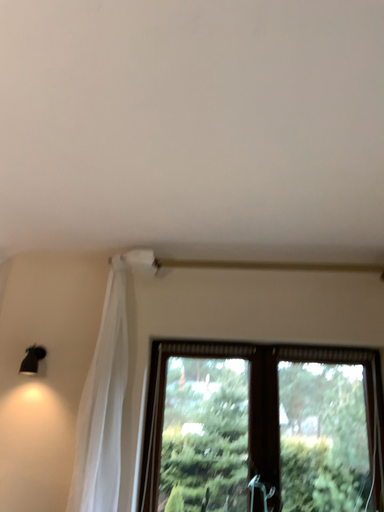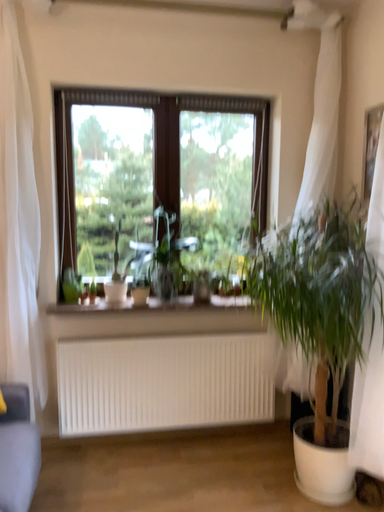
Question: Which way did the camera rotate in the video?

Choices:
 (A) rotated upward
 (B) rotated downward

Answer: (B)